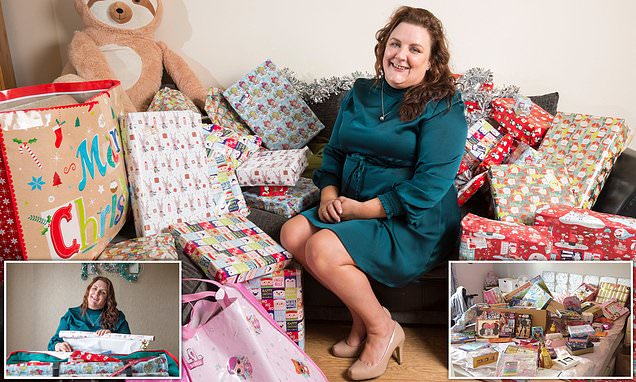
At what (x,y) coordinates should I click in order to perform the action: click on tinsel garland. Please return your answer as a coordinate pair (x, y). Image resolution: width=636 pixels, height=382 pixels. Looking at the image, I should click on (338, 87).